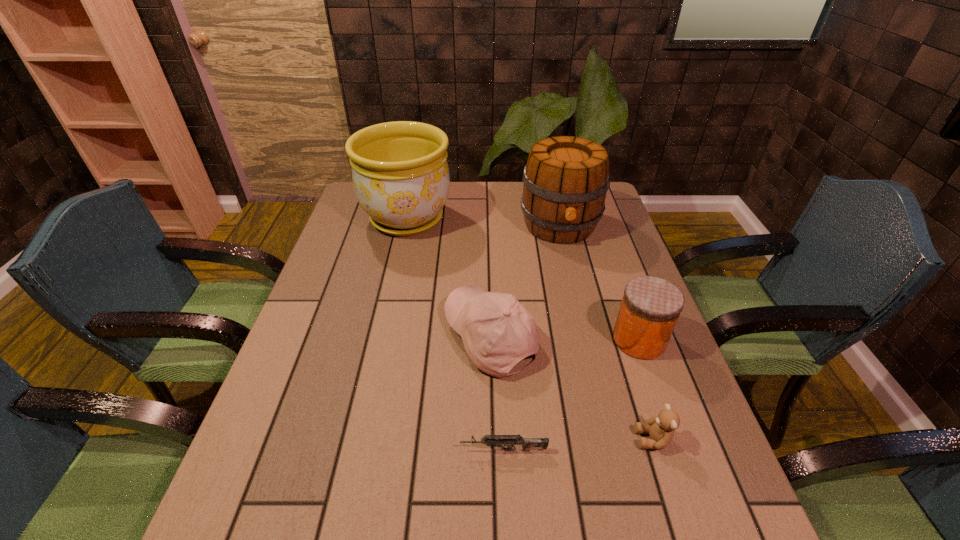
You are a GUI agent. You are given a task and a screenshot of the screen. Output one action in this format:
    pyautogui.click(x=<x>, y=<y>)
    Task: Click on the flowerpot
    Image resolution: width=960 pixels, height=540 pixels.
    Given the screenshot: What is the action you would take?
    pyautogui.click(x=400, y=173)

This screenshot has height=540, width=960. Identify the location of cider. (566, 179).

Where is `jar`? The height and width of the screenshot is (540, 960). jar is located at coordinates (650, 308).

You are a GUI agent. You are given a task and a screenshot of the screen. Output one action in this format:
    pyautogui.click(x=<x>, y=<y>)
    Task: Click on the baseball cap
    The width and height of the screenshot is (960, 540).
    Given the screenshot: What is the action you would take?
    pyautogui.click(x=497, y=331)

Identify the location of teddy bear. The image size is (960, 540). pyautogui.click(x=661, y=429).

The image size is (960, 540). Find the location of `gun`. gun is located at coordinates (490, 440).

Image resolution: width=960 pixels, height=540 pixels. What are the coordinates of `free region located 0.260m on the right of the flowerpot` in the screenshot? It's located at (530, 219).

In order to click on free space located 0.050m on the side of the cider where the spigot is located in this screenshot , I will do `click(568, 262)`.

In order to click on vacant region located on the left of the jar in this screenshot , I will do `click(531, 340)`.

At what (x,y) coordinates should I click in order to perform the action: click on free space located on the front-facing side of the baseball cap. Please return your answer as a coordinate pair (x, y). The width and height of the screenshot is (960, 540). Looking at the image, I should click on [x=399, y=338].